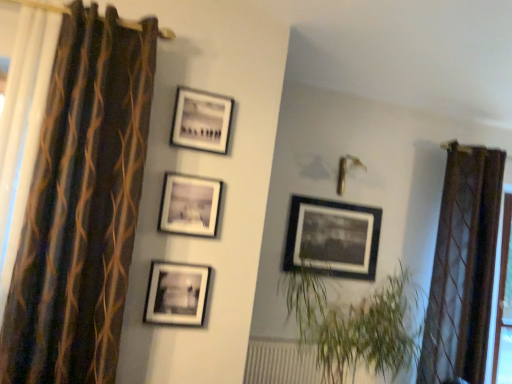
Question: Is brown striped curtain at left, positioned as the first curtain in front-to-back order, taller or shorter than matte black picture frame at center, which is the 2th picture frame in left-to-right order?

Choices:
 (A) short
 (B) tall

Answer: (B)

Question: Considering the relative positions of brown striped curtain at left, which appears as the first curtain when viewed from the left, and matte black picture frame at center, the 3th picture frame when ordered from back to front, in the image provided, is brown striped curtain at left, which appears as the first curtain when viewed from the left, to the left or to the right of matte black picture frame at center, the 3th picture frame when ordered from back to front,?

Choices:
 (A) left
 (B) right

Answer: (A)

Question: Which is farther from the matte black picture frame at upper center, which ranks as the third picture frame in front-to-back order?

Choices:
 (A) brown sheer curtain at right, which is the 2th curtain in left-to-right order
 (B) brown striped curtain at left, which is counted as the second curtain, starting from the right
 (C) matte black picture frame at center, the 3th picture frame when ordered from back to front
 (D) green leafy plant at center
 (E) matte black picture frame at center, positioned as the first picture frame in left-to-right order

Answer: (A)

Question: Which of these objects is positioned farthest from the matte black picture frame at center, positioned as the first picture frame in left-to-right order?

Choices:
 (A) matte black picture frame at center, acting as the 4th picture frame starting from the left
 (B) green leafy plant at center
 (C) matte black picture frame at upper center, which ranks as the 2th picture frame in right-to-left order
 (D) matte black picture frame at center, the 3th picture frame when ordered from back to front
 (E) brown striped curtain at left, which appears as the first curtain when viewed from the left

Answer: (A)